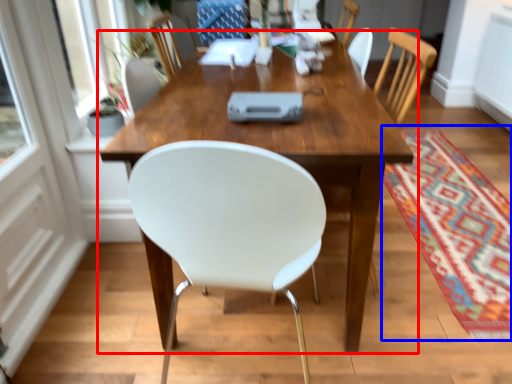
Question: Which object is closer to the camera taking this photo, table (highlighted by a red box) or mat (highlighted by a blue box)?

Choices:
 (A) table
 (B) mat

Answer: (A)